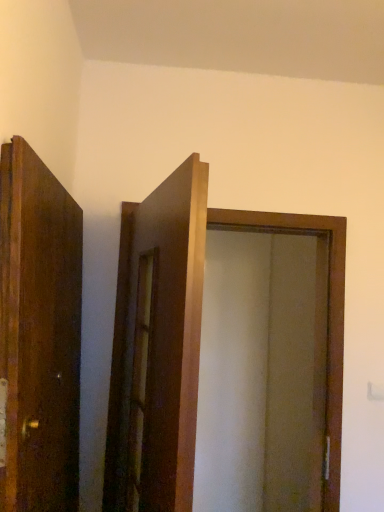
The height and width of the screenshot is (512, 384). Describe the element at coordinates (328, 316) in the screenshot. I see `matte wooden screen door at center` at that location.

The image size is (384, 512). Identify the location of matte wooden screen door at center. (328, 316).

Measure the distance between matte wooden screen door at center and camera.

matte wooden screen door at center is 5.61 feet away from camera.

I want to click on matte wooden screen door at center, so click(x=328, y=316).